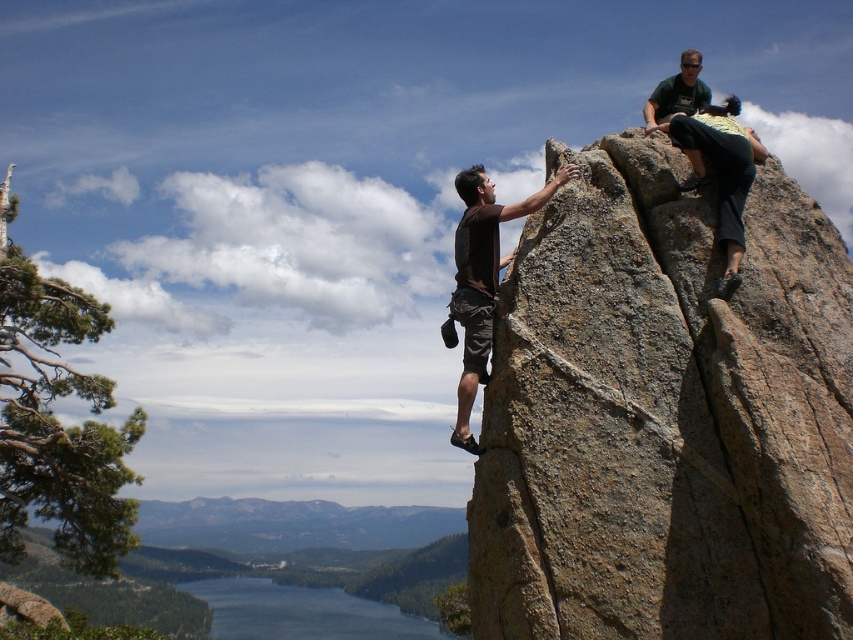
What do you see at coordinates (665, 416) in the screenshot? I see `brown rock at upper right` at bounding box center [665, 416].

Does brown rock at upper right have a greater width compared to blue glassy water at lower left?

→ No, brown rock at upper right is not wider than blue glassy water at lower left.

Does point (561, 612) come closer to viewer compared to point (228, 616)?

Yes, point (561, 612) is closer to viewer.

Where is `brown rock at upper right`? The width and height of the screenshot is (853, 640). brown rock at upper right is located at coordinates (665, 416).

Who is lower down, brown rock at upper right or green fabric shirt at upper right?

brown rock at upper right is below.

Which is in front, point (804, 472) or point (692, 77)?

Point (804, 472) is more forward.

Find the location of a particular element. brown rock at upper right is located at coordinates (665, 416).

Is point (471, 396) more distant than point (682, 106)?

That is False.

How distant is brown matte shorts at center from green fabric shirt at upper right?

They are 23.00 meters apart.

Is point (498, 218) closer to viewer compared to point (682, 72)?

Yes, it is in front of point (682, 72).

Locate an element on the screen. The image size is (853, 640). brown matte shorts at center is located at coordinates (482, 276).